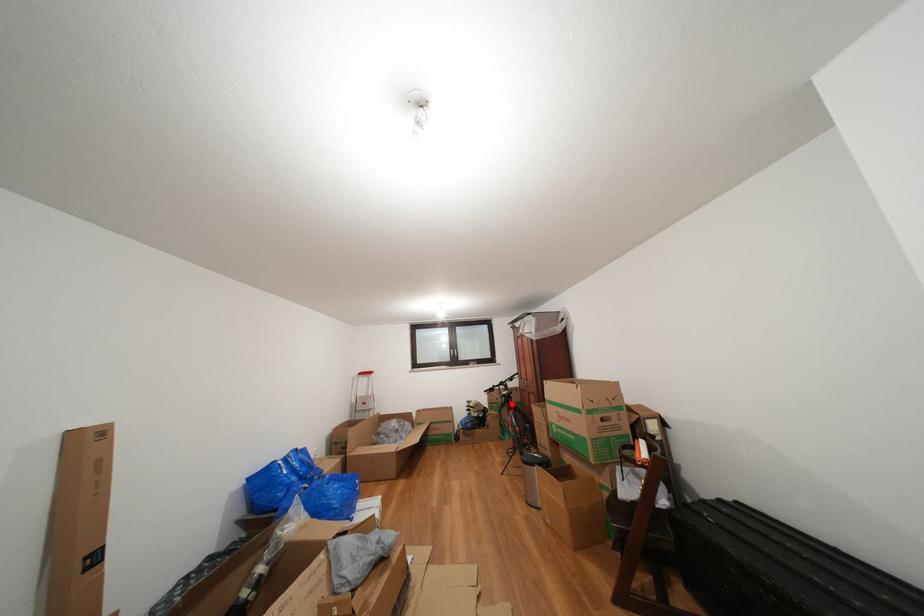
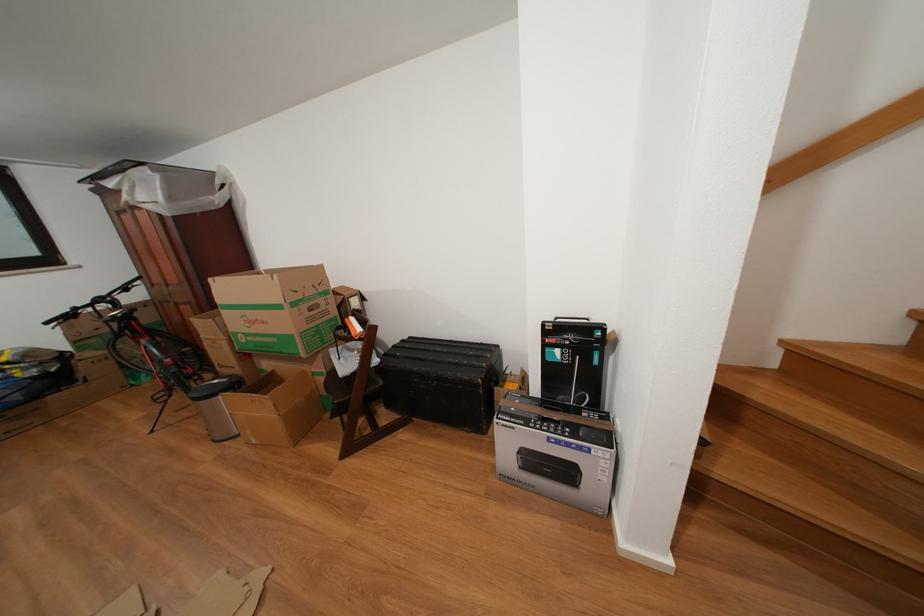
Where in the second image is the point corresponding to the highlighted location from the first image?

(123, 330)